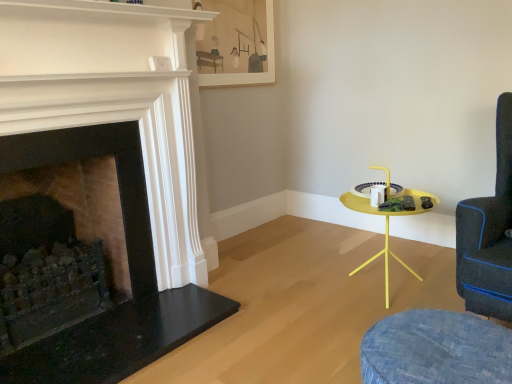
This screenshot has width=512, height=384. Identify the location of empty space that is to the right of matte black fireplace at left, which is the 2th fireplace from left to right. (276, 319).